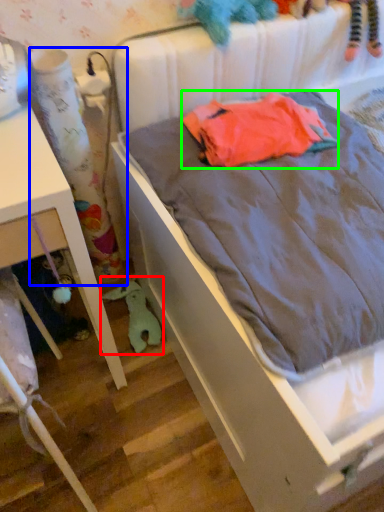
Question: Based on their relative distances, which object is nearer to toy (highlighted by a red box)? Choose from curtain (highlighted by a blue box) and baby clothe (highlighted by a green box).

Choices:
 (A) curtain
 (B) baby clothe

Answer: (A)